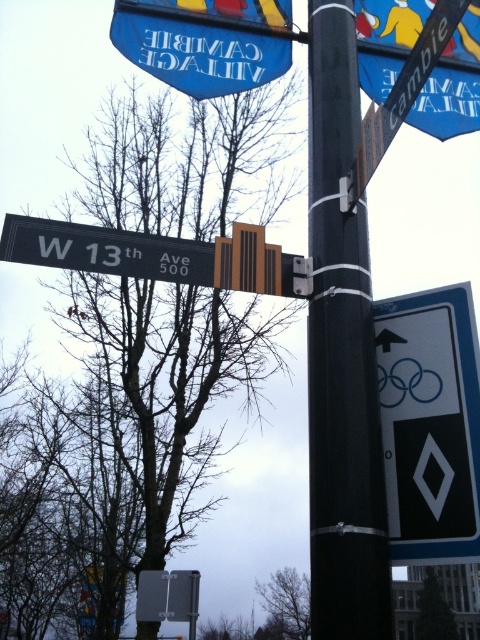
Question: Does white plastic diamond at upper right have a lesser width compared to metallic silver parking sign at center?

Choices:
 (A) no
 (B) yes

Answer: (B)

Question: Is blue fabric banner at upper center closer to the viewer compared to metallic silver parking sign at center?

Choices:
 (A) yes
 (B) no

Answer: (A)

Question: Estimate the real-world distances between objects in this image. Which object is farther from the blue fabric banner at upper center?

Choices:
 (A) bare branches at center
 (B) black plastic street sign at upper left

Answer: (A)

Question: Which point appears closest to the camera in this image?

Choices:
 (A) (152, 570)
 (B) (218, 67)
 (C) (294, 291)

Answer: (C)

Question: Can you confirm if black plastic pole at center is positioned above black plastic street sign at upper left?

Choices:
 (A) yes
 (B) no

Answer: (B)

Question: Which object is positioned closest to the green leafy tree at lower right?

Choices:
 (A) bare branches at center
 (B) white plastic diamond at upper right

Answer: (A)